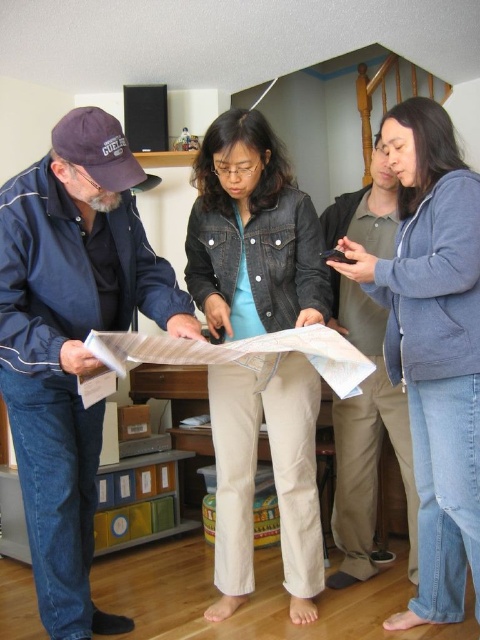
Who is more forward, (x=61, y=202) or (x=216, y=292)?

Point (x=61, y=202) is more forward.

Does blue fabric jacket at left have a greater height compared to denim jacket at center?

Incorrect, blue fabric jacket at left's height is not larger of denim jacket at center's.

Is point (46, 387) farther from viewer compared to point (197, 220)?

No, it is not.

The width and height of the screenshot is (480, 640). I want to click on blue fabric jacket at left, so [x=72, y=340].

Does point (237, 196) lie in front of point (350, 353)?

No.

Measure the distance between point (x=240, y=179) and camera.

Point (x=240, y=179) is 1.90 meters from camera.

Find the location of a particular element. The height and width of the screenshot is (640, 480). denim jacket at center is located at coordinates (252, 234).

Is point (108, 248) less distant than point (428, 524)?

Yes.

Can you confirm if blue fabric jacket at left is positioned below blue fleece jacket at upper right?

Indeed, blue fabric jacket at left is positioned under blue fleece jacket at upper right.

Identify the location of blue fabric jacket at left. Image resolution: width=480 pixels, height=640 pixels. (72, 340).